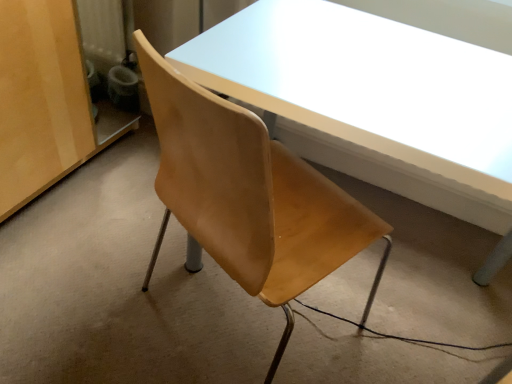
Question: Does matte white table at center have a greater width compared to wooden chair at center?

Choices:
 (A) yes
 (B) no

Answer: (B)

Question: Is the position of matte white table at center less distant than that of wooden chair at center?

Choices:
 (A) yes
 (B) no

Answer: (A)

Question: Does matte white table at center touch wooden chair at center?

Choices:
 (A) no
 (B) yes

Answer: (A)

Question: Does matte white table at center have a smaller size compared to wooden chair at center?

Choices:
 (A) no
 (B) yes

Answer: (A)

Question: Is matte white table at center thinner than wooden chair at center?

Choices:
 (A) yes
 (B) no

Answer: (A)

Question: In the image, is matte white table at center on the left side or the right side of matte wood cabinet at left?

Choices:
 (A) right
 (B) left

Answer: (A)

Question: Considering the positions of matte white table at center and matte wood cabinet at left in the image, is matte white table at center taller or shorter than matte wood cabinet at left?

Choices:
 (A) tall
 (B) short

Answer: (A)

Question: Is point (269, 61) closer or farther from the camera than point (14, 173)?

Choices:
 (A) closer
 (B) farther

Answer: (A)

Question: From the image's perspective, is matte white table at center above or below matte wood cabinet at left?

Choices:
 (A) above
 (B) below

Answer: (B)

Question: In terms of height, does wooden chair at center look taller or shorter compared to matte white table at center?

Choices:
 (A) tall
 (B) short

Answer: (B)

Question: From the image's perspective, is wooden chair at center located above or below matte white table at center?

Choices:
 (A) above
 (B) below

Answer: (B)

Question: Looking at their shapes, would you say wooden chair at center is wider or thinner than matte white table at center?

Choices:
 (A) thin
 (B) wide

Answer: (B)

Question: Is point (358, 304) closer or farther from the camera than point (473, 46)?

Choices:
 (A) closer
 (B) farther

Answer: (B)

Question: From a real-world perspective, is wooden chair at center positioned above or below matte wood cabinet at left?

Choices:
 (A) above
 (B) below

Answer: (B)

Question: Is wooden chair at center inside the boundaries of matte wood cabinet at left, or outside?

Choices:
 (A) outside
 (B) inside

Answer: (A)